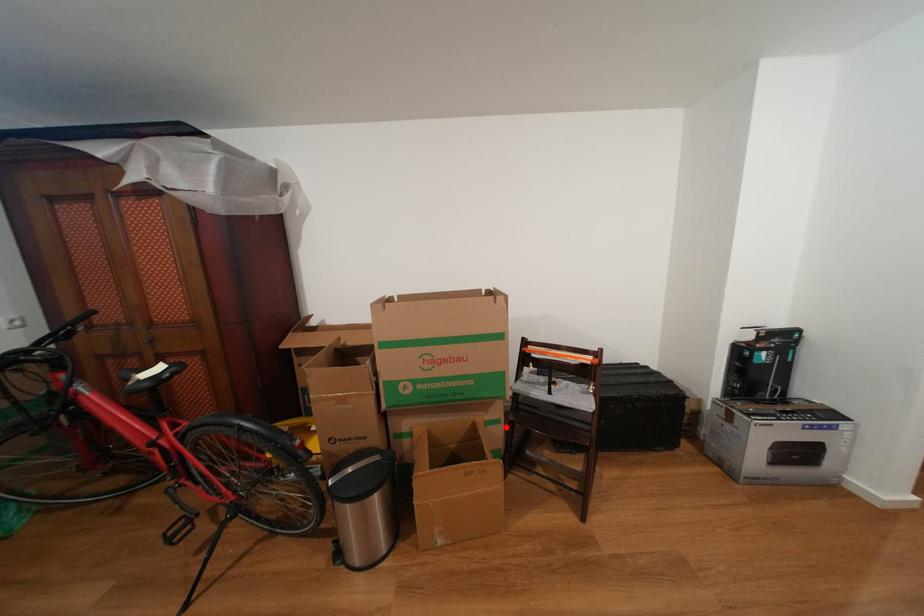
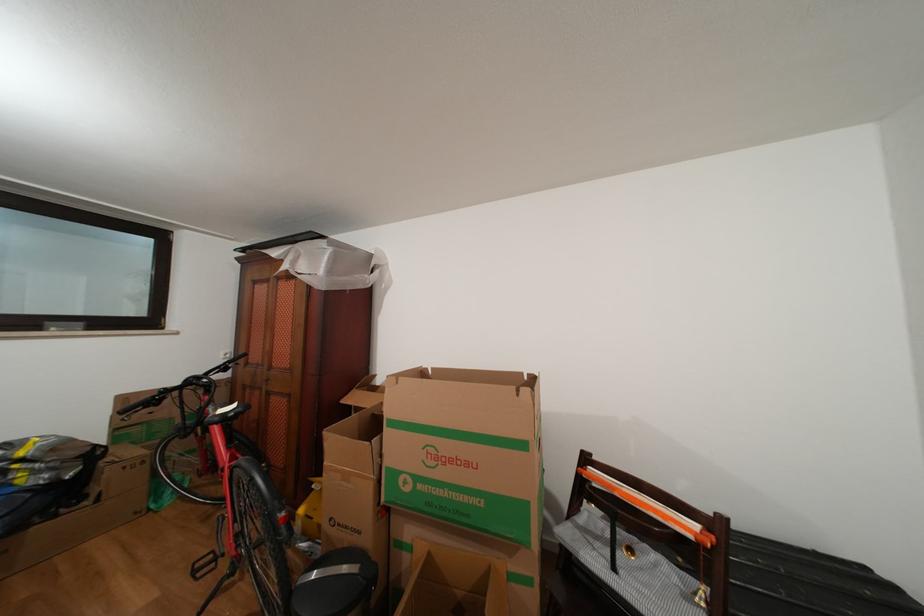
Question: I am providing you with two images of the same scene from different viewpoints. Image1 has a red point marked. In image2, the corresponding 3D location appears at what relative position? Reply with the corresponding letter.

Choices:
 (A) Closer
 (B) Farther

Answer: (A)